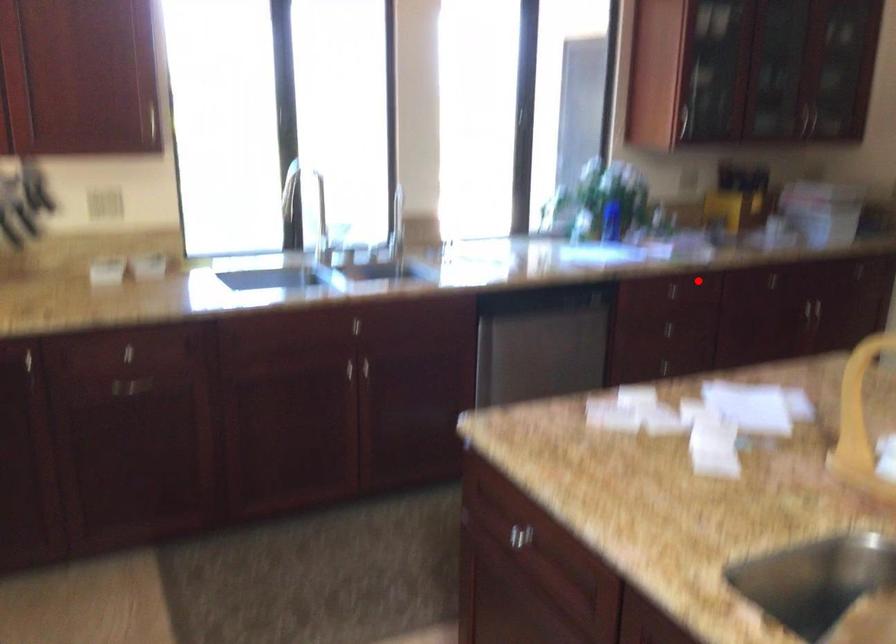
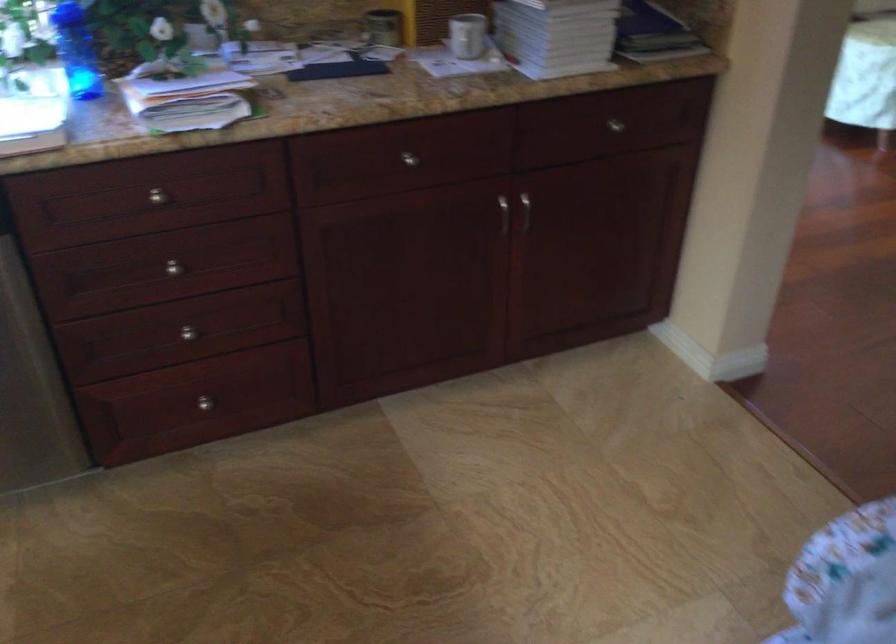
Where in the second image is the point corresponding to the highlighted location from the first image?

(156, 196)